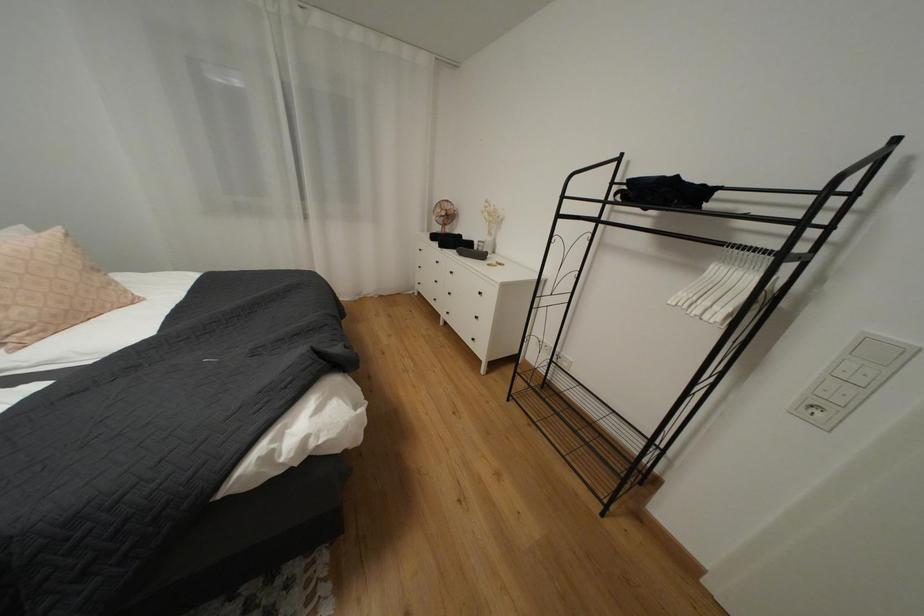
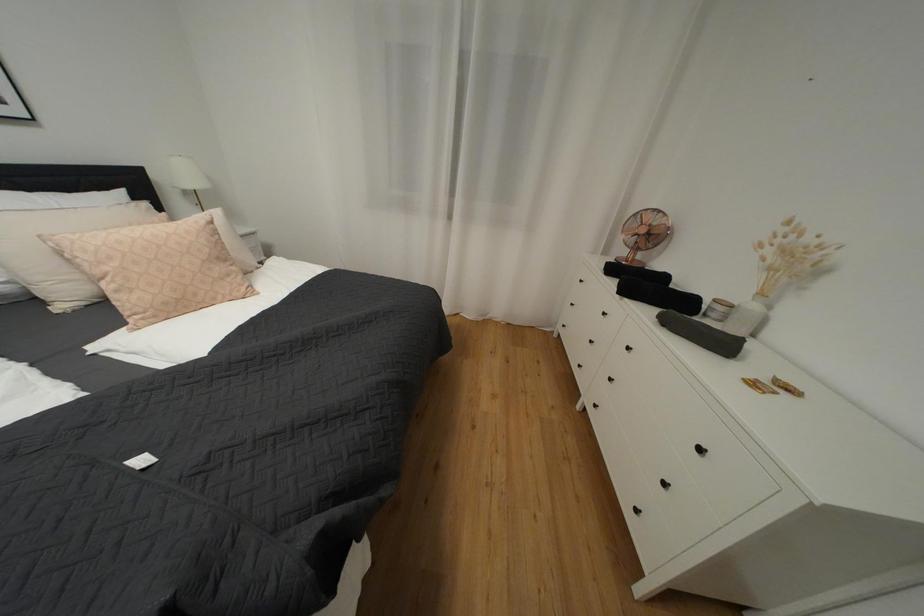
Question: The images are taken continuously from a first-person perspective. In which direction is your viewpoint rotating?

Choices:
 (A) Left
 (B) Right
 (C) Up
 (D) Down

Answer: (A)